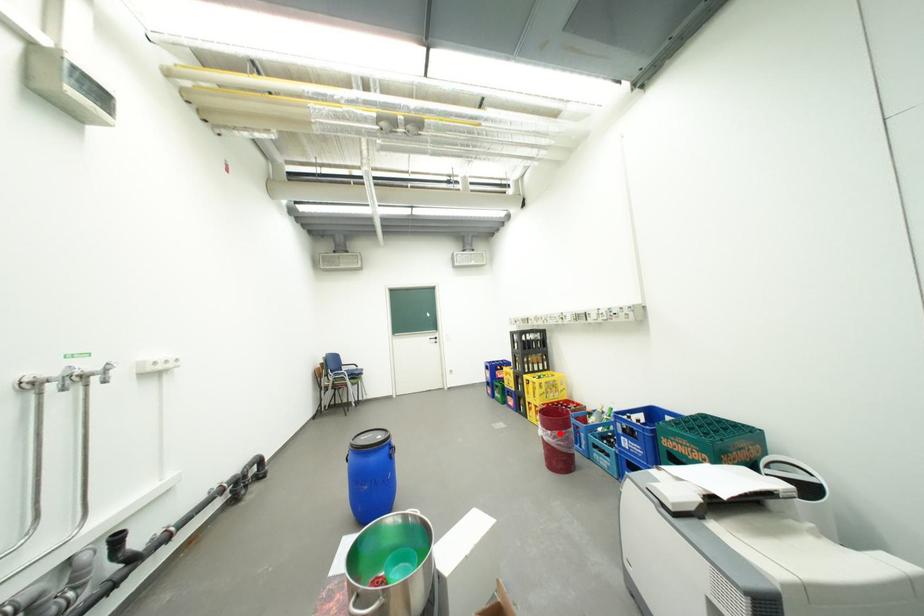
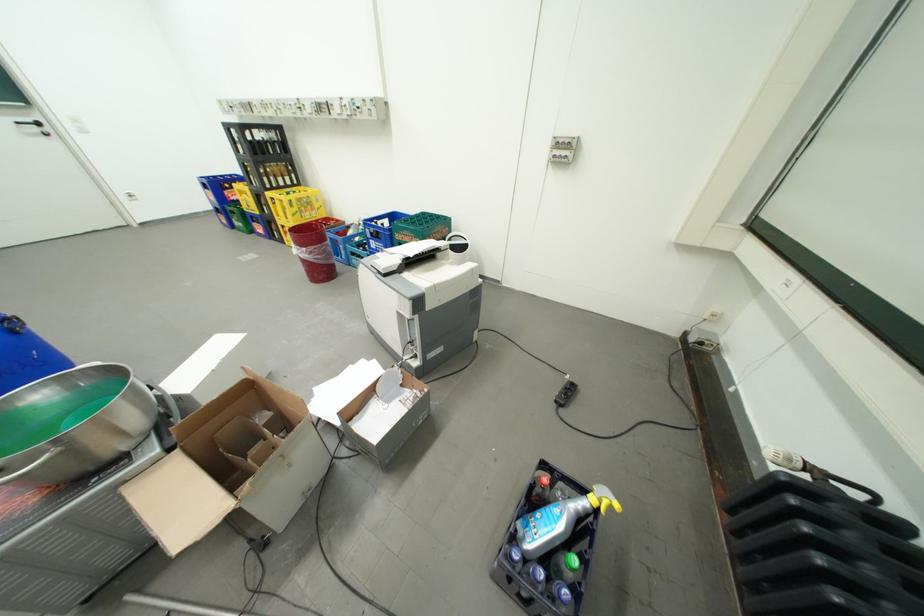
Question: I am providing you with two images of the same scene from different viewpoints. A red point is shown in image1. For the corresponding object point in image2, is it positioned nearer or farther from the camera?

Choices:
 (A) Nearer
 (B) Farther

Answer: (A)